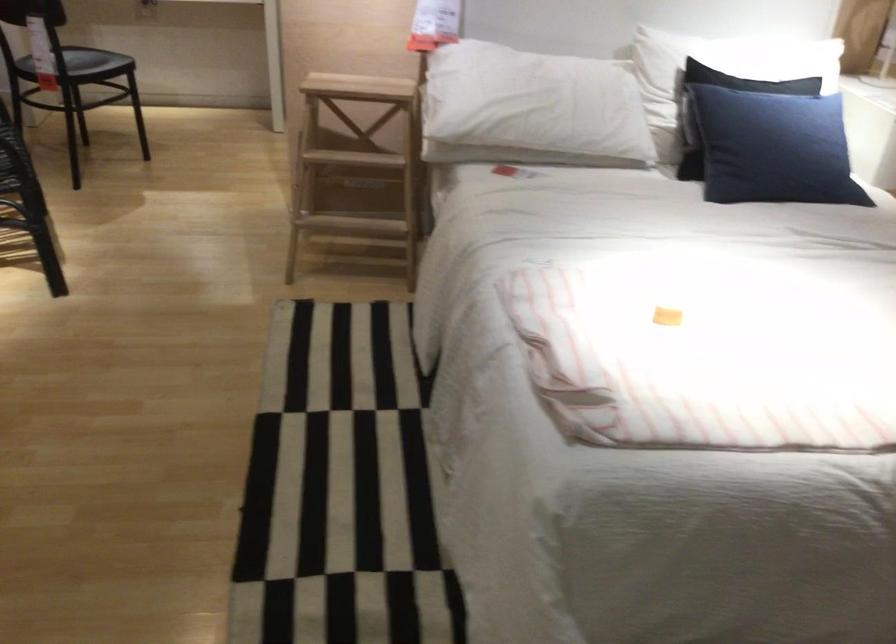
Find where to lift the black pillow. Please return your answer as a coordinate pair (x, y).

(773, 147)